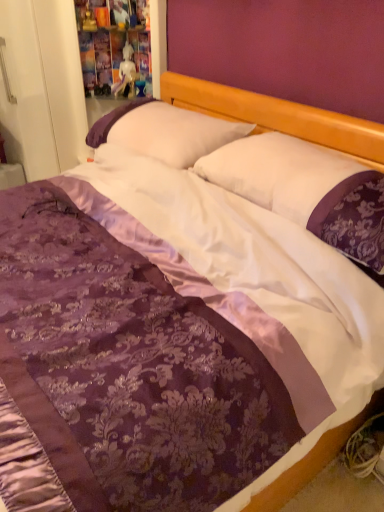
Question: Considering the positions of point (132, 53) and point (114, 129), is point (132, 53) closer or farther from the camera than point (114, 129)?

Choices:
 (A) farther
 (B) closer

Answer: (A)

Question: Looking at their shapes, would you say white glossy statue at upper center is wider or thinner than white satin pillow at center, the second pillow viewed from the front?

Choices:
 (A) wide
 (B) thin

Answer: (B)

Question: Which object is positioned closest to the white satin pillow at center, the second pillow viewed from the front?

Choices:
 (A) white glossy statue at upper center
 (B) white satin pillow at center, the 1th pillow positioned from the front

Answer: (B)

Question: Estimate the real-world distances between objects in this image. Which object is closer to the white glossy statue at upper center?

Choices:
 (A) white satin pillow at center, the second pillow viewed from the front
 (B) white satin pillow at center, the second pillow viewed from the back

Answer: (A)